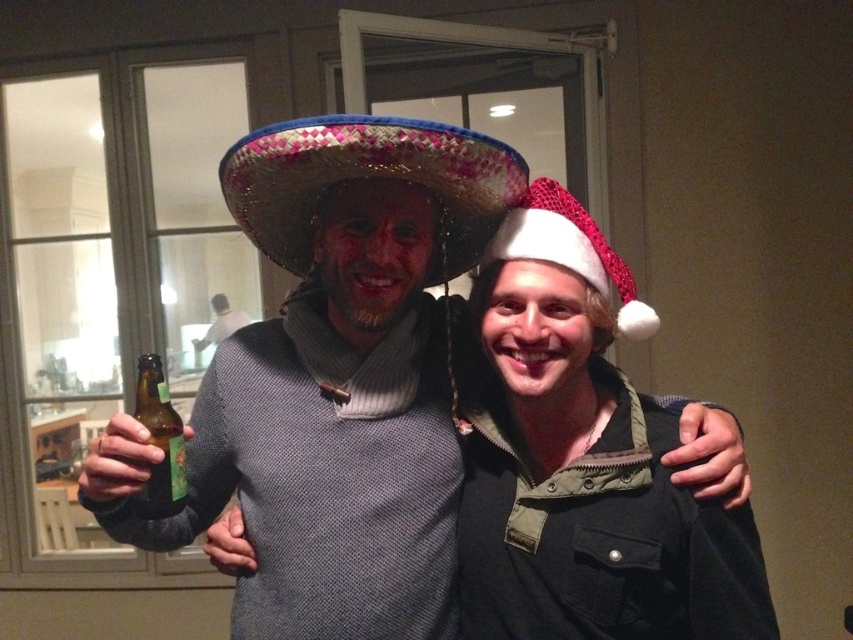
Can you confirm if matte straw sombrero at center is positioned to the left of green matte beer bottle at center?

In fact, matte straw sombrero at center is to the right of green matte beer bottle at center.

The height and width of the screenshot is (640, 853). What do you see at coordinates (332, 380) in the screenshot? I see `matte straw sombrero at center` at bounding box center [332, 380].

I want to click on matte straw sombrero at center, so click(332, 380).

How distant is fuzzy straw sombrero at right from green matte beer bottle at center?

fuzzy straw sombrero at right and green matte beer bottle at center are 19.92 inches apart.

This screenshot has width=853, height=640. I want to click on fuzzy straw sombrero at right, so click(x=570, y=250).

Locate an element on the screen. fuzzy straw sombrero at right is located at coordinates (570, 250).

Which is more to the left, white felt santa hat at right or fuzzy straw sombrero at right?

Positioned to the left is white felt santa hat at right.

Between white felt santa hat at right and fuzzy straw sombrero at right, which one has less height?

fuzzy straw sombrero at right

Where is `white felt santa hat at right`? This screenshot has height=640, width=853. white felt santa hat at right is located at coordinates (581, 461).